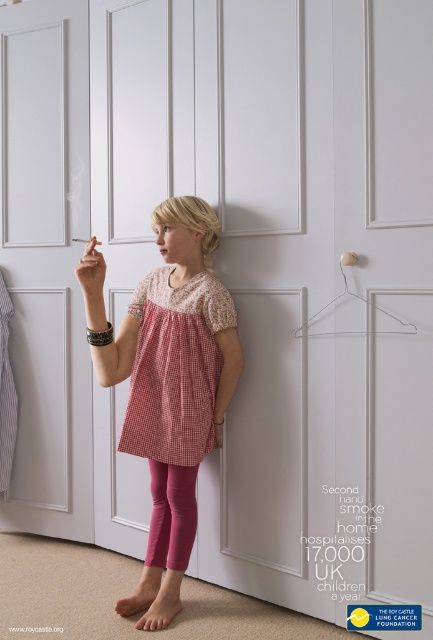
You are a delivery person trying to enter the house through the white wood door at center. There is a wire at upper right above the door. Can you fit through the door without bending down, considering the wire might be an obstacle?

The white wood door at center is wider than the wire at upper right, but the question is about height. The description does not provide information about the height of the door or the wire, so it is unclear if bending down is necessary. However, since the wire is at the upper right, it might be above head height, so you might need to duck. But without specific measurements, we can only assume the door is tall enough for a standard entrance. The wire might be an obstruction but not necessarily requiring you

You are an interior designer planning to hang a picture frame that requires a hook. You notice the wire at upper right. Where exactly is the wire located in the image?

The wire at upper right is located at point coordinates of 0.467 in the x axis and 0.824 in the y axis.

You are a delivery person trying to enter the house. The entrance is through the white wood door at center. However, there is a wire at upper right in your path. Can you walk straight to the door without bending down or moving sideways?

The white wood door at center is further to the viewer than the wire at upper right, so the wire is closer to you. Since the wire is closer, you would need to move around it or adjust your path to avoid it before reaching the door.